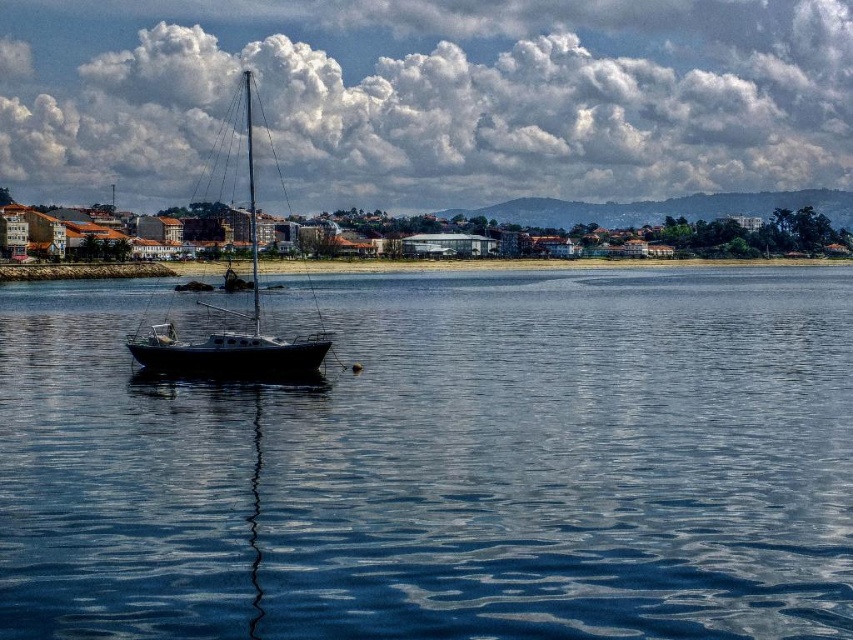
Question: Among these points, which one is nearest to the camera?

Choices:
 (A) (294, 356)
 (B) (410, 488)
 (C) (270, 1)

Answer: (B)

Question: Is transparent blue water at center to the left of white fluffy cloud at upper center from the viewer's perspective?

Choices:
 (A) yes
 (B) no

Answer: (A)

Question: Is transparent blue water at center bigger than shiny black sailboat at center?

Choices:
 (A) yes
 (B) no

Answer: (B)

Question: Among these objects, which one is nearest to the camera?

Choices:
 (A) shiny black sailboat at center
 (B) transparent blue water at center

Answer: (B)

Question: Does transparent blue water at center have a smaller size compared to white fluffy cloud at upper center?

Choices:
 (A) yes
 (B) no

Answer: (A)

Question: Which point appears closest to the camera in this image?

Choices:
 (A) (648, 109)
 (B) (317, 342)
 (C) (223, 394)

Answer: (C)